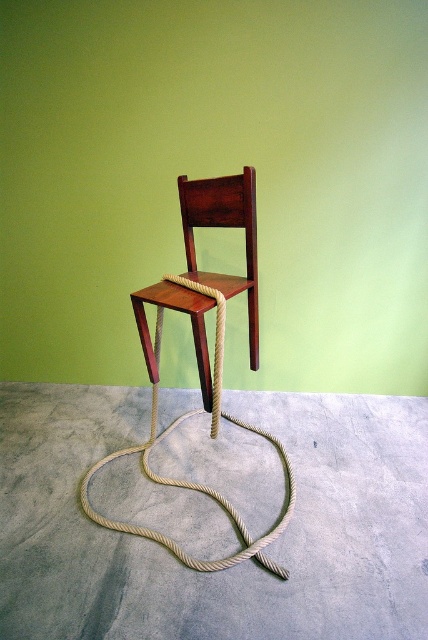
You are a photographer standing at the camera position. You want to take a closeup shot of the mahogany wood chair at center. What is the minimum distance you need to move towards the chair to get within 1 meter for the shot?

The mahogany wood chair at center and camera are 1.44 meters apart. To get within 1 meter, you need to move 0.44 meters closer to the chair.

You are standing in front of the minimalist scene with a light green wall and gray floor. You see the mahogany wood chair at center and the natural beige rope at center. Which object is closer to you?

The mahogany wood chair at center is closer to the viewer than the natural beige rope at center.

You are an interior designer assessing the space in the image. You need to determine if the natural beige rope at center can be easily removed without disturbing the wooden chair at center. Based on their relative sizes, is this feasible?

The natural beige rope at center is taller than the wooden chair at center, so removing the rope might require moving the chair first since the rope extends above the chair, making it harder to access without shifting the chair.